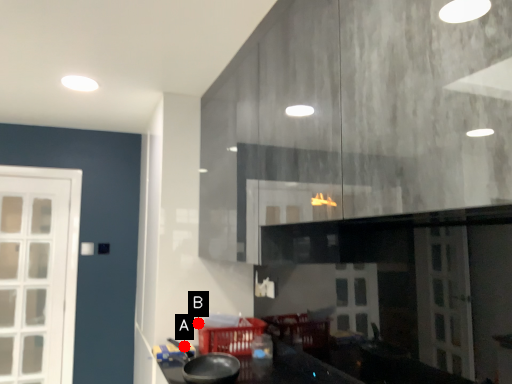
Question: Two points are circled on the image, labeled by A and B beside each circle. Which point is farther to the camera?

Choices:
 (A) A is further
 (B) B is further

Answer: (B)